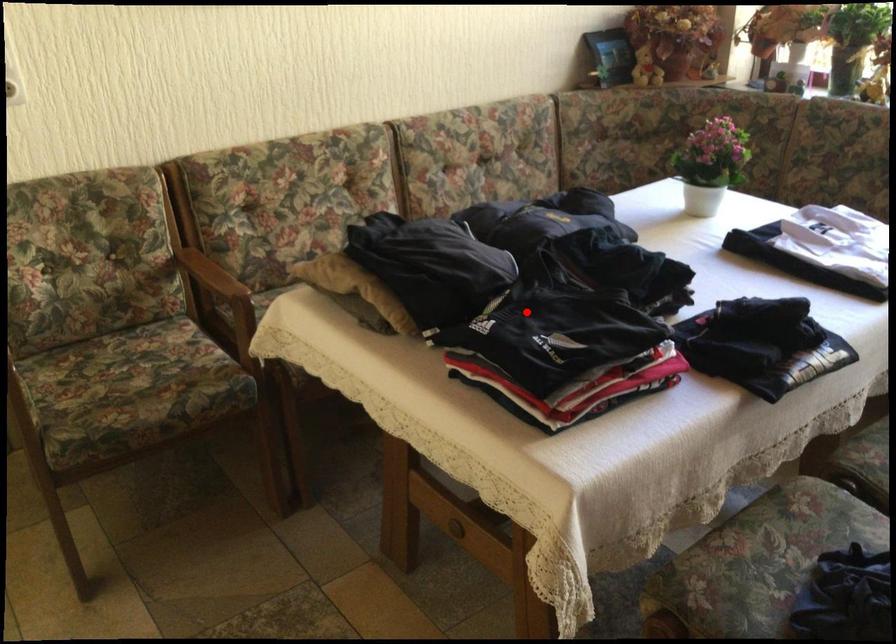
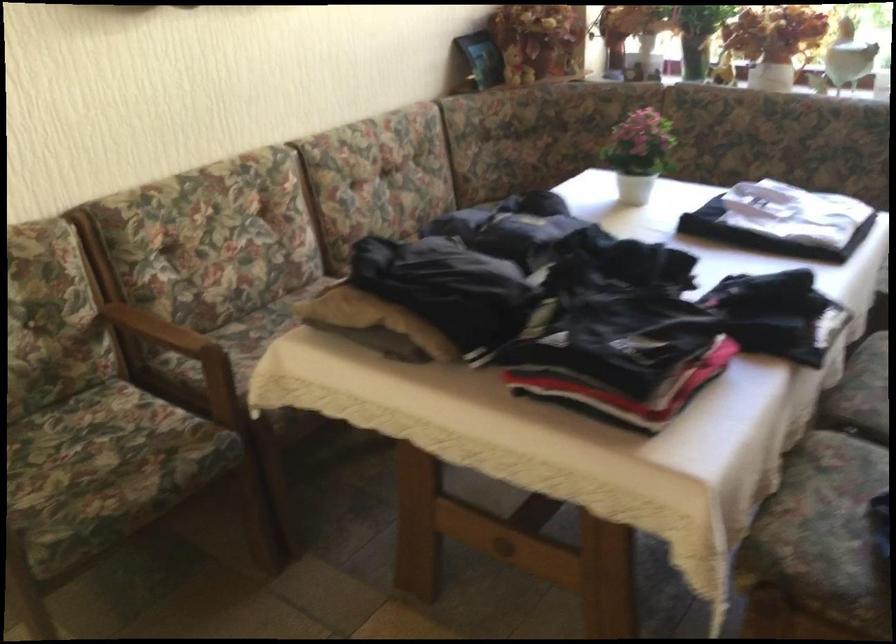
Locate, in the second image, the point that corresponds to the highlighted location in the first image.

(589, 317)